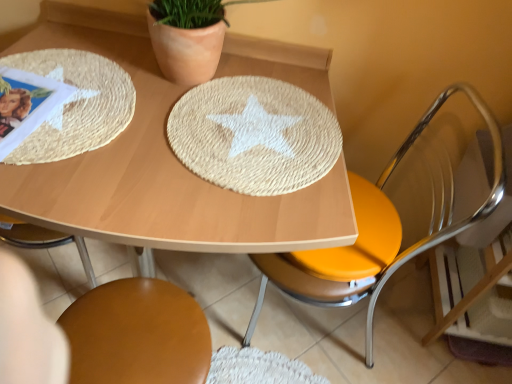
You are a GUI agent. You are given a task and a screenshot of the screen. Output one action in this format:
    pyautogui.click(x=<x>, y=<y>)
    Task: Click on the vacant space behind brown leather chair at lower center, positioned as the second chair in right-to-left order
    
    Given the screenshot: What is the action you would take?
    pyautogui.click(x=212, y=291)